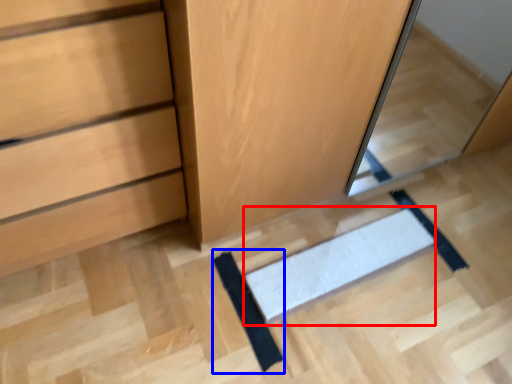
Question: Among these objects, which one is farthest to the camera, doormat (highlighted by a red box) or doormat (highlighted by a blue box)?

Choices:
 (A) doormat
 (B) doormat

Answer: (A)